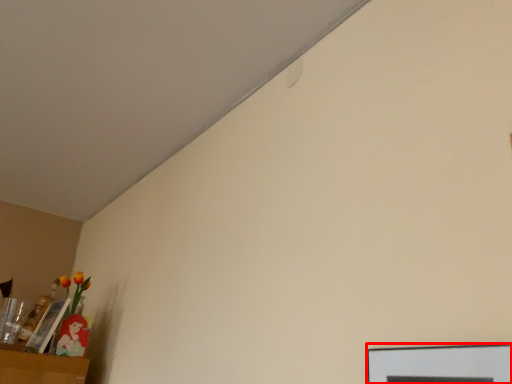
Question: Where is picture frame (annotated by the red box) located in relation to picture frame in the image?

Choices:
 (A) left
 (B) right

Answer: (B)